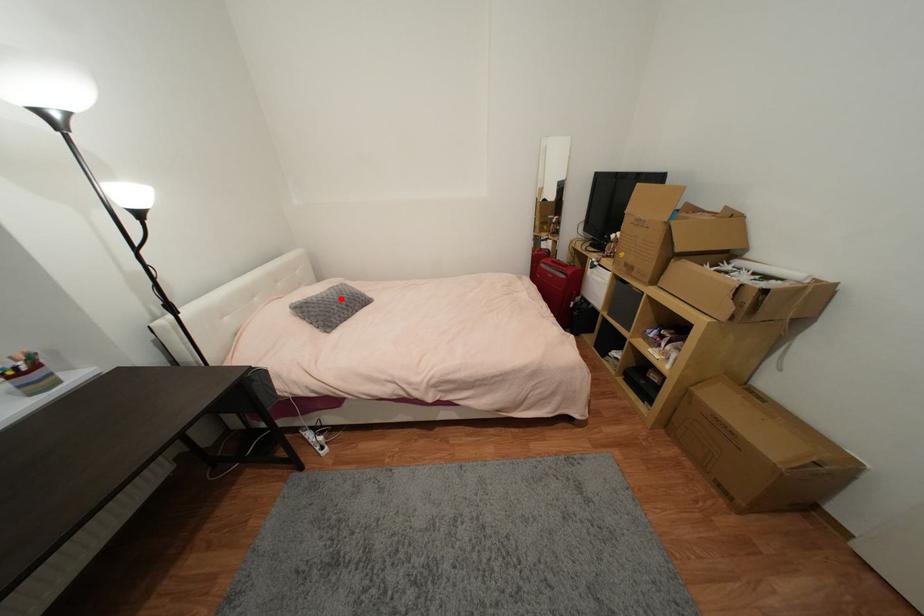
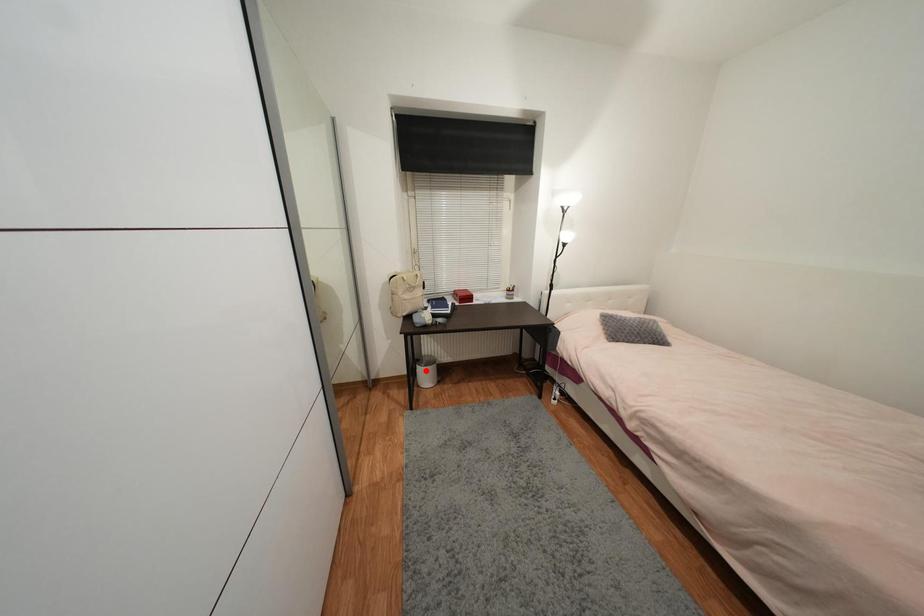
I am providing you with two images of the same scene from different viewpoints. A red point is marked on the first image and another point is marked on the second image. Do the highlighted points in image1 and image2 indicate the same real-world spot?

No